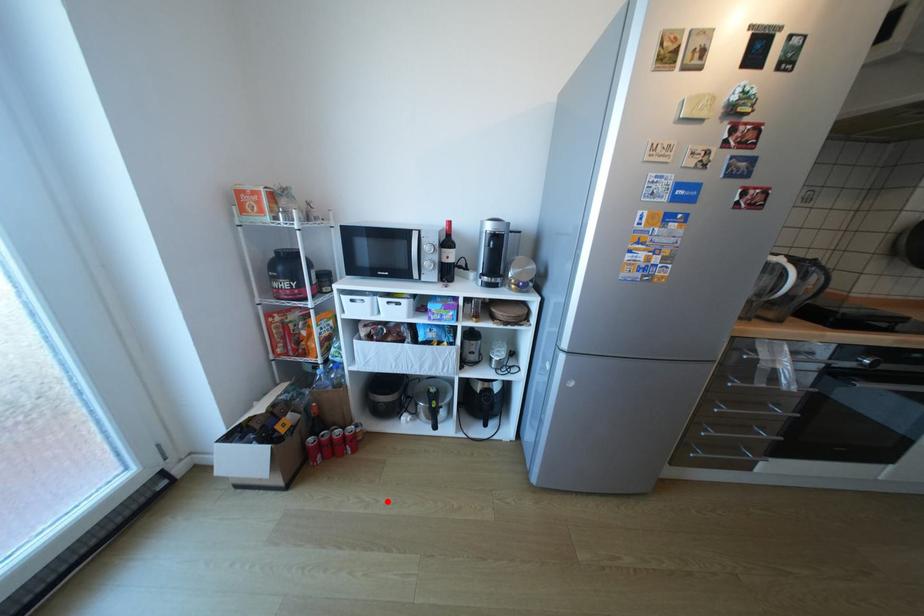
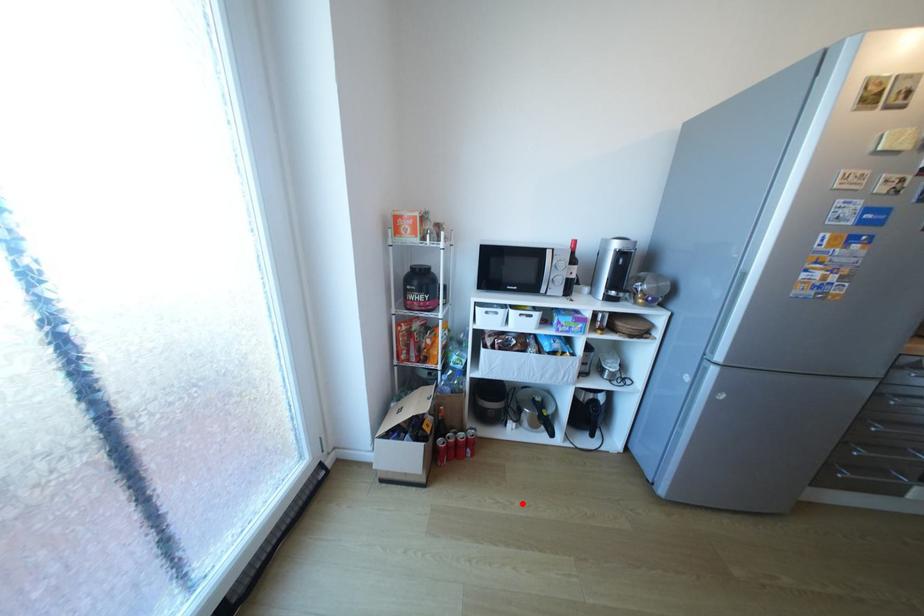
I am providing you with two images of the same scene from different viewpoints. A red point is marked on the first image and another point is marked on the second image. Are the points marked in image1 and image2 representing the same 3D position?

Yes